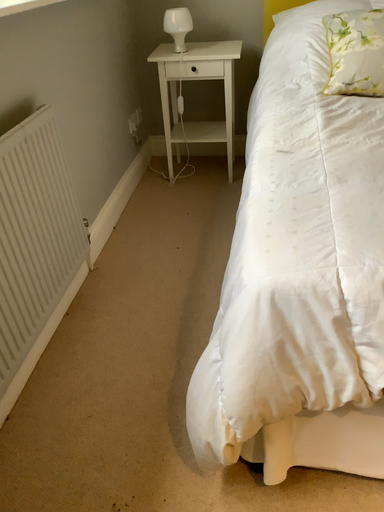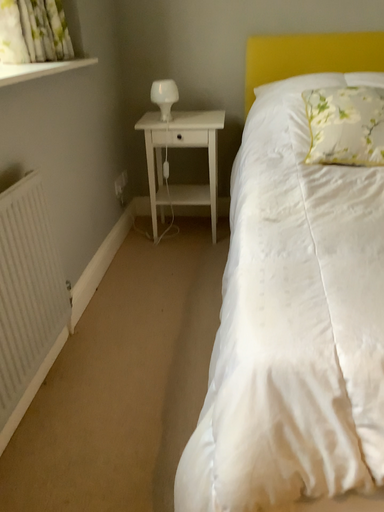
Question: How did the camera likely rotate when shooting the video?

Choices:
 (A) rotated downward
 (B) rotated upward

Answer: (B)